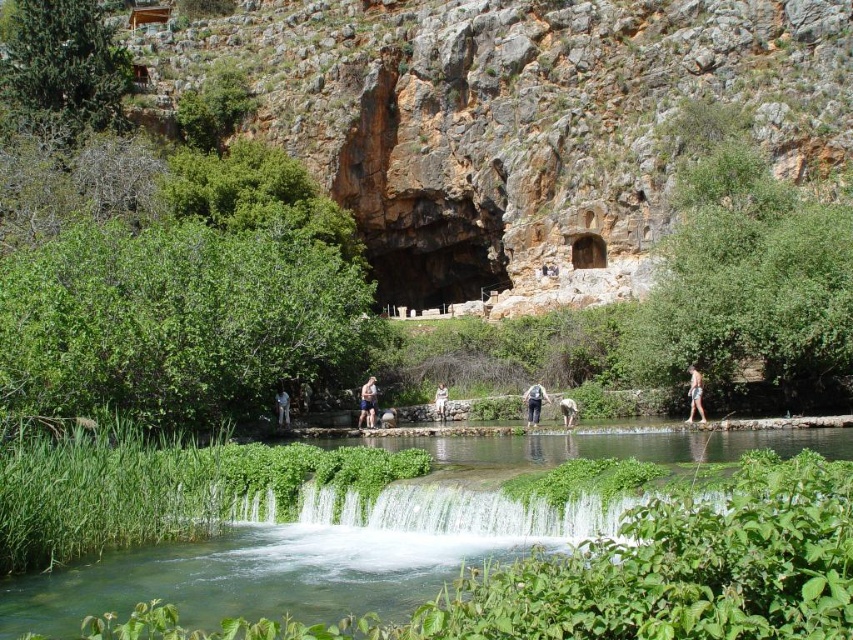
Question: Is matte gray backpack at center smaller than light brown leather backpack at center?

Choices:
 (A) no
 (B) yes

Answer: (A)

Question: Which point is farther to the camera?

Choices:
 (A) (444, 401)
 (B) (692, 372)

Answer: (A)

Question: Based on their relative distances, which object is farther from the matte gray backpack at center?

Choices:
 (A) light brown wooden stick at center
 (B) clear water at center

Answer: (B)

Question: Does light brown wooden stick at lower center appear on the left side of light brown leather backpack at center?

Choices:
 (A) no
 (B) yes

Answer: (A)

Question: Can you confirm if light brown leather jacket at center is positioned above white cotton shirt at center?

Choices:
 (A) yes
 (B) no

Answer: (A)

Question: Which point is closer to the camera taking this photo?

Choices:
 (A) (281, 554)
 (B) (563, 397)

Answer: (A)